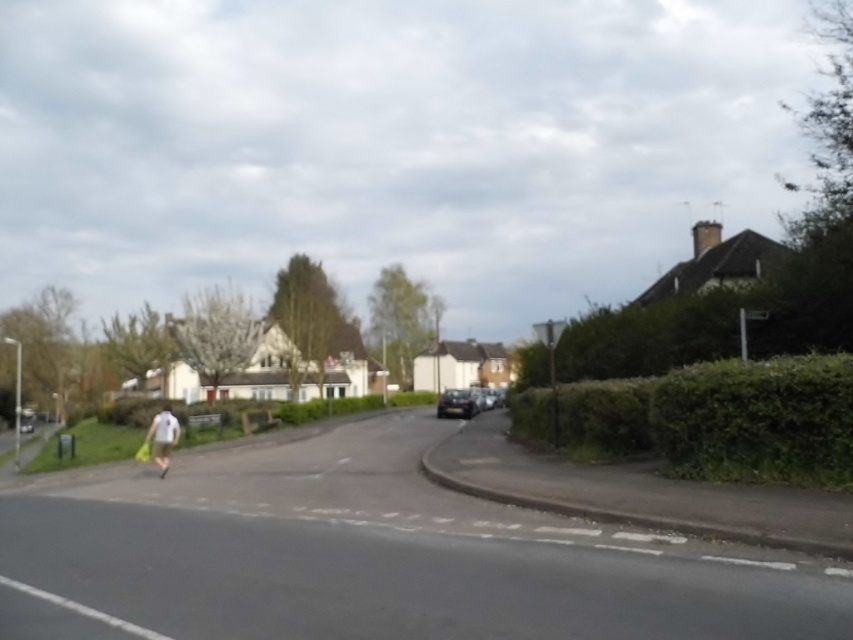
Which is above, white fabric bag at lower left or shiny black car at center?

white fabric bag at lower left

Is white fabric bag at lower left shorter than shiny black car at center?

In fact, white fabric bag at lower left may be taller than shiny black car at center.

Between point (164, 461) and point (473, 406), which one is positioned behind?

The point (473, 406) is behind.

I want to click on white fabric bag at lower left, so click(x=161, y=436).